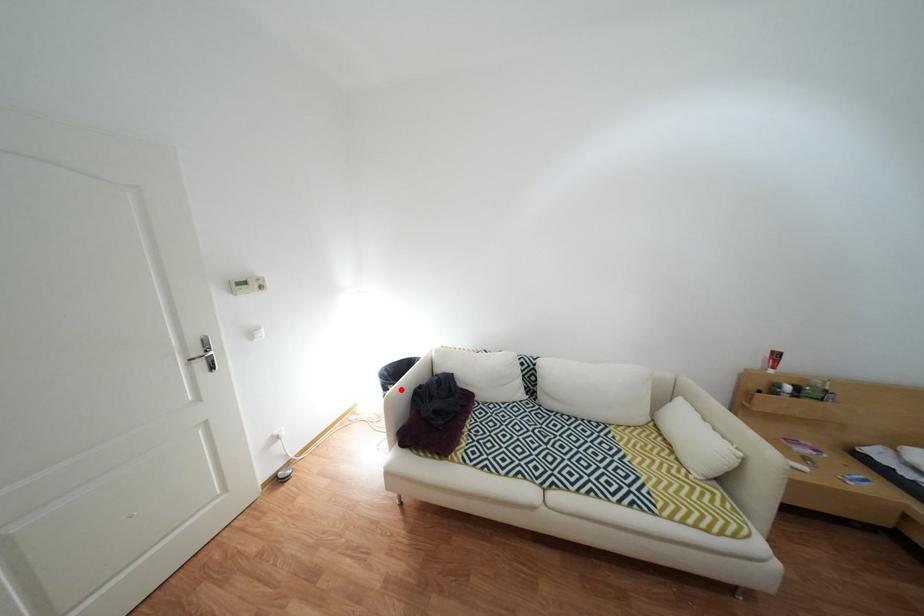
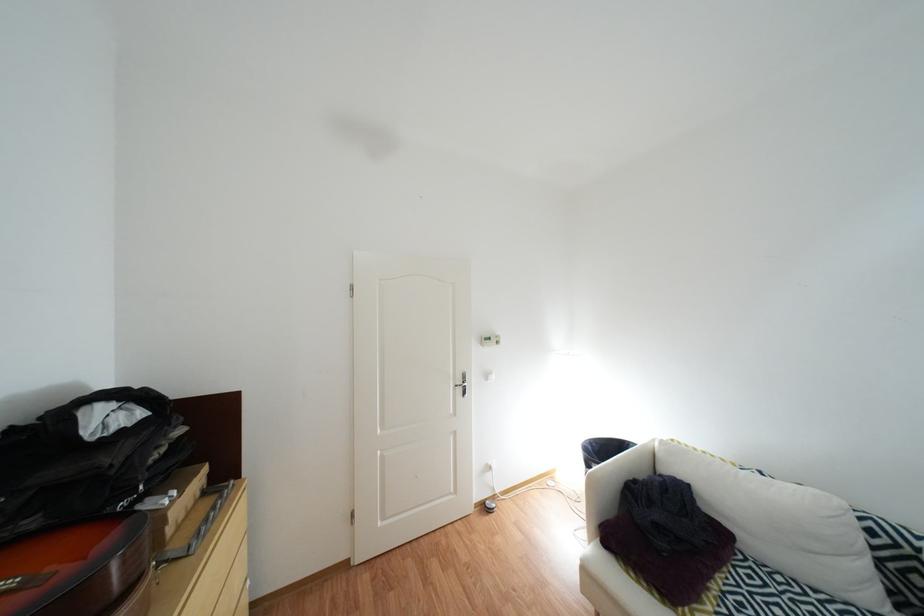
Where in the second image is the point corresponding to the highlighted location from the first image?

(603, 466)